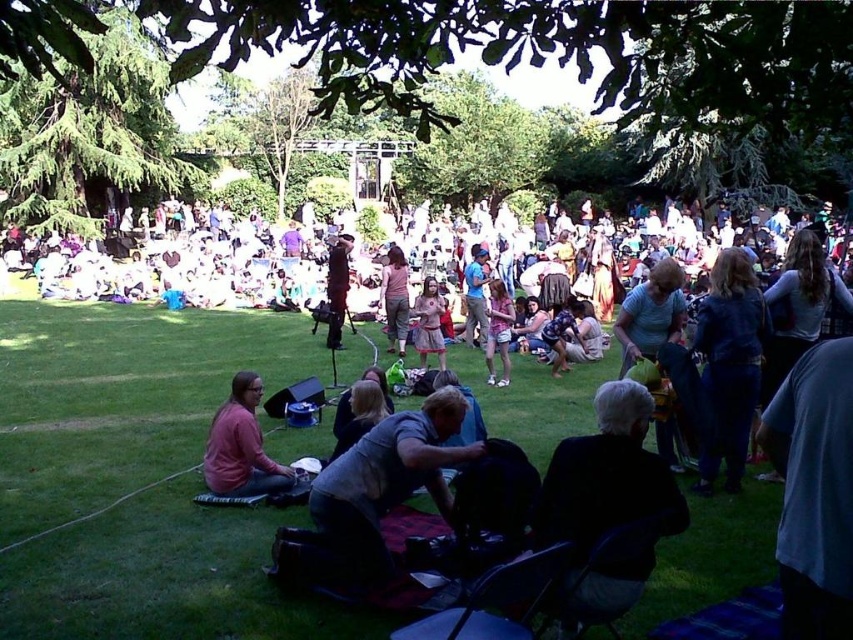
Question: Which point is closer to the camera taking this photo?

Choices:
 (A) click(223, 460)
 (B) click(492, 340)

Answer: (A)

Question: Which object is positioned farthest from the pink matte sweater at lower left?

Choices:
 (A) gray fabric bag at center
 (B) matte pink dress at center
 (C) shiny black suit at center
 (D) denim jacket at right

Answer: (C)

Question: Observing the image, what is the correct spatial positioning of dark gray fabric chair at lower right in reference to matte pink dress at center?

Choices:
 (A) below
 (B) above

Answer: (A)

Question: Does denim jacket at right appear on the left side of pink matte sweater at lower left?

Choices:
 (A) no
 (B) yes

Answer: (A)

Question: Does dark gray fabric chair at lower right appear under shiny black suit at center?

Choices:
 (A) yes
 (B) no

Answer: (A)

Question: Which point is farther to the camera?

Choices:
 (A) light pink denim shorts at center
 (B) denim jacket at right
 (C) shiny black suit at center
 (D) pink fabric skirt at center

Answer: (D)